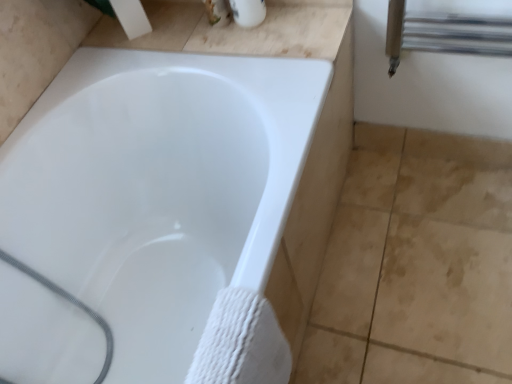
What do you see at coordinates (166, 202) in the screenshot?
I see `white glossy bathtub at center` at bounding box center [166, 202].

Measure the distance between white glossy bathtub at center and camera.

white glossy bathtub at center and camera are 62.49 centimeters apart from each other.

Measure the distance between point (x=127, y=313) and camera.

The depth of point (x=127, y=313) is 3.86 feet.

You are a GUI agent. You are given a task and a screenshot of the screen. Output one action in this format:
    pyautogui.click(x=<x>, y=<y>)
    Task: Click on the white glossy bathtub at center
    This screenshot has width=512, height=384.
    Given the screenshot: What is the action you would take?
    pyautogui.click(x=166, y=202)

Where is `white glossy bathtub at center`? The image size is (512, 384). white glossy bathtub at center is located at coordinates (166, 202).